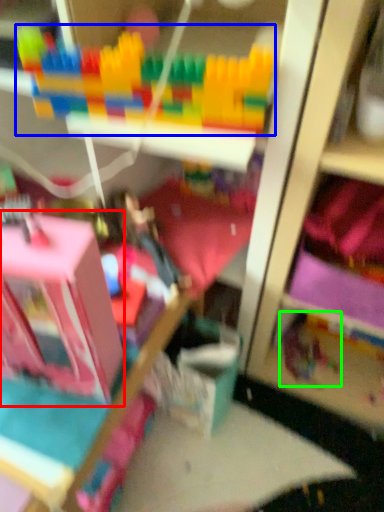
Question: Which object is the closest to the toy (highlighted by a red box)? Choose among these: toy (highlighted by a blue box) or toy (highlighted by a green box).

Choices:
 (A) toy
 (B) toy

Answer: (A)